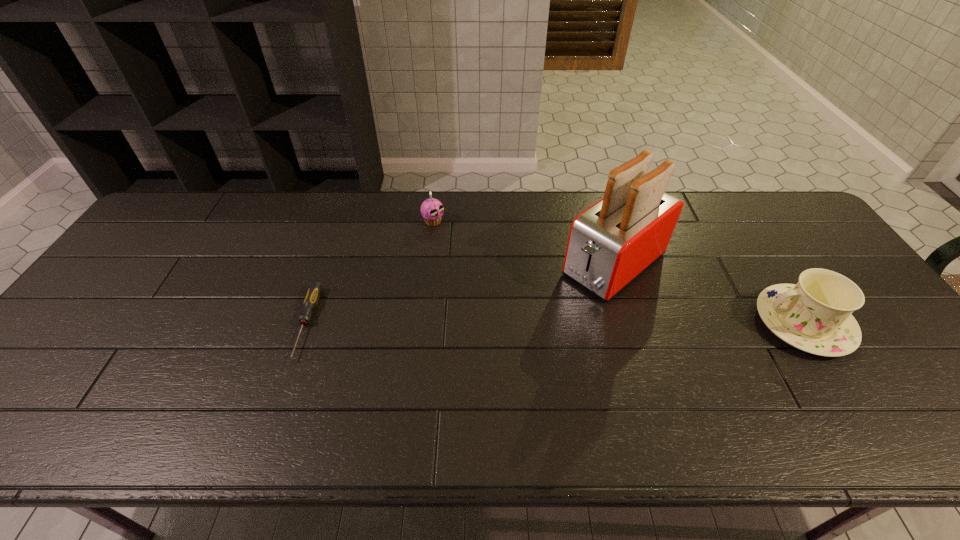
Locate an element on the screen. The height and width of the screenshot is (540, 960). the shortest object is located at coordinates (312, 296).

Where is `screwdriver`? screwdriver is located at coordinates (312, 296).

Where is `the rightmost object`? This screenshot has height=540, width=960. the rightmost object is located at coordinates (815, 315).

At what (x,y) coordinates should I click in order to perform the action: click on cupcake. Please return your answer as a coordinate pair (x, y). This screenshot has height=540, width=960. Looking at the image, I should click on (432, 210).

At what (x,y) coordinates should I click in order to perform the action: click on the farthest object. Please return your answer as a coordinate pair (x, y). The width and height of the screenshot is (960, 540). Looking at the image, I should click on (432, 210).

Locate an element on the screen. This screenshot has width=960, height=540. the tallest object is located at coordinates (612, 242).

The image size is (960, 540). In order to click on toaster in this screenshot , I will do `click(612, 242)`.

Find the location of `free space located insert the screwdriver into a screw head`. free space located insert the screwdriver into a screw head is located at coordinates (285, 384).

The image size is (960, 540). Find the location of `vacant space located on the handle side of the rightmost object`. vacant space located on the handle side of the rightmost object is located at coordinates (621, 323).

Where is `free space located on the handle side of the rightmost object`? The width and height of the screenshot is (960, 540). free space located on the handle side of the rightmost object is located at coordinates (726, 323).